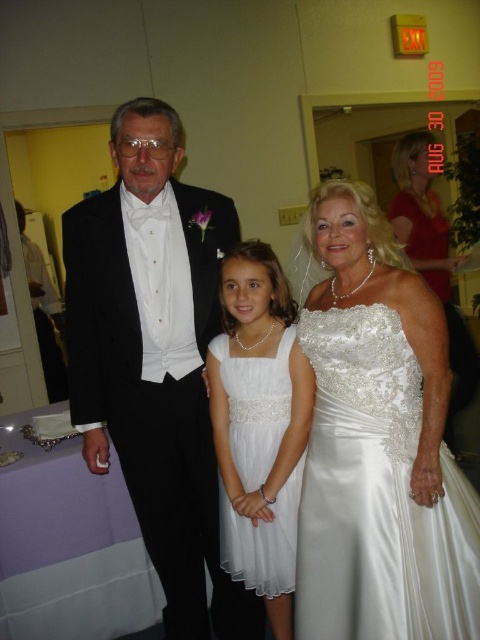
Does satin/embroidered dress at center appear over white satin dress at center?

Indeed, satin/embroidered dress at center is positioned over white satin dress at center.

Which is below, satin/embroidered dress at center or white satin dress at center?

white satin dress at center is below.

Between point (338, 504) and point (254, 420), which one is positioned behind?

Point (254, 420)

Find the location of a particular element. Image resolution: width=480 pixels, height=640 pixels. satin/embroidered dress at center is located at coordinates (377, 493).

Based on the photo, between satin dress at center and white satin dress at center, which one has less height?

white satin dress at center

Which is in front, point (180, 193) or point (250, 403)?

Positioned in front is point (250, 403).

Where is `satin dress at center`? satin dress at center is located at coordinates (135, 307).

Is black satin tuxedo at left smaller than satin dress at center?

Yes, black satin tuxedo at left is smaller than satin dress at center.

Between point (217, 627) and point (132, 102), which one is positioned behind?

The point (217, 627) is more distant.

Between point (127, 387) and point (83, 397), which one is positioned in front?

Point (127, 387) is in front.

Identify the location of black satin tuxedo at left. (155, 358).